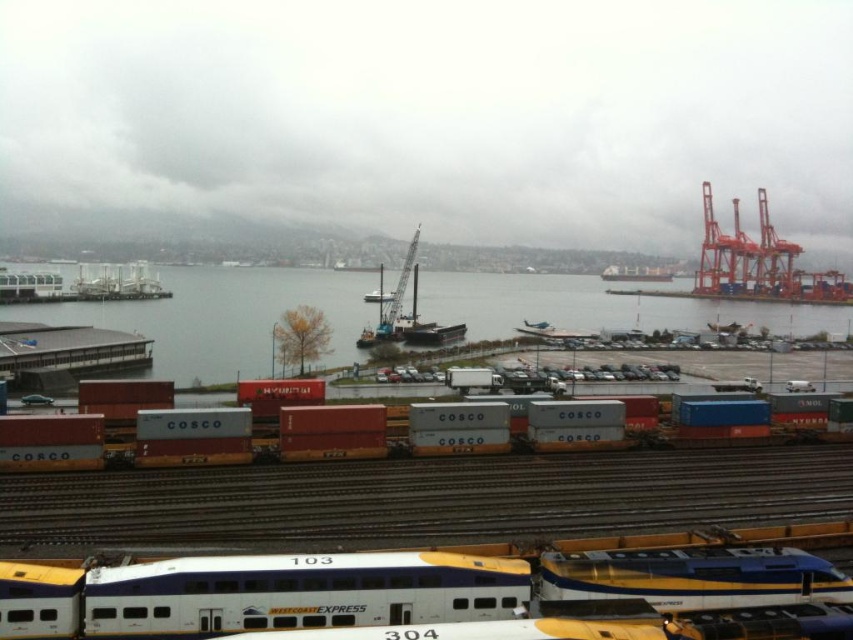
Question: From the image, what is the correct spatial relationship of metallic brown train track at lower center in relation to white glossy train at center?

Choices:
 (A) right
 (B) left

Answer: (A)

Question: Is metallic gray container at center bigger than metallic gray dock at lower left?

Choices:
 (A) yes
 (B) no

Answer: (A)

Question: Among these points, which one is farthest from the camera?

Choices:
 (A) (103, 330)
 (B) (329, 580)

Answer: (A)

Question: Can you confirm if metallic brown train track at lower center is thinner than white glossy train at center?

Choices:
 (A) yes
 (B) no

Answer: (B)

Question: Which object appears closest to the camera in this image?

Choices:
 (A) white glossy train at center
 (B) clear water at lower left

Answer: (A)

Question: Which of the following is the closest to the observer?

Choices:
 (A) clear water at lower left
 (B) metallic gray dock at lower left
 (C) metallic gray container at center

Answer: (C)